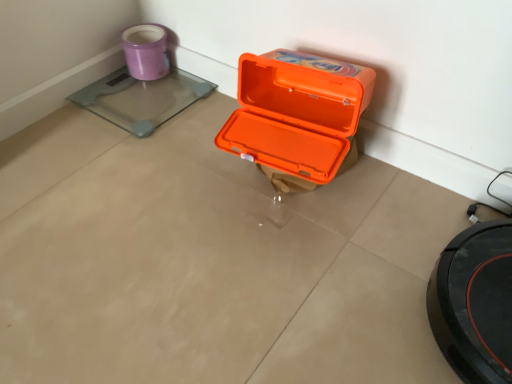
Where is `vacant area that is in front of matte purple mug at upper left`? vacant area that is in front of matte purple mug at upper left is located at coordinates (140, 100).